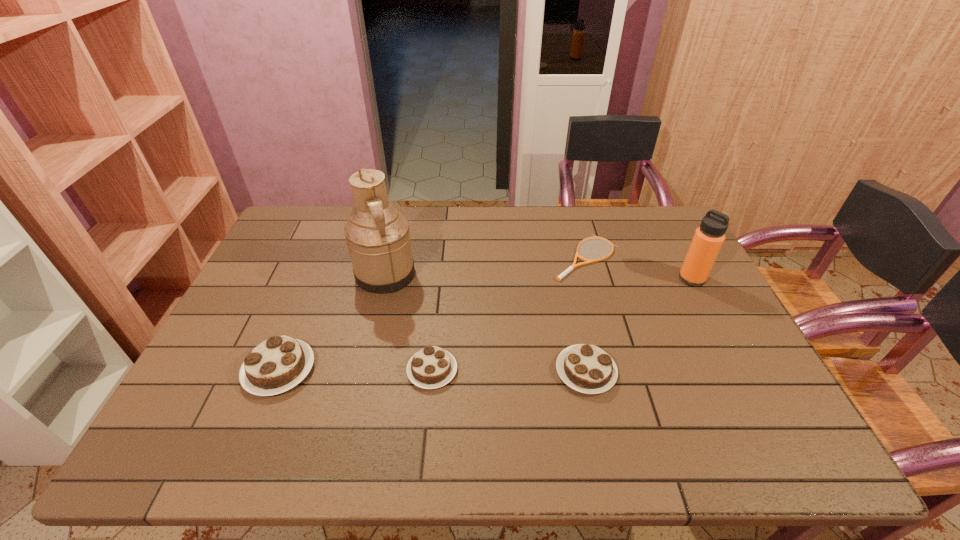
You are a GUI agent. You are given a task and a screenshot of the screen. Output one action in this format:
    pyautogui.click(x=<x>, y=<y>)
    Task: Click on the vacant region at the far edge
    The width and height of the screenshot is (960, 540).
    Given the screenshot: What is the action you would take?
    pyautogui.click(x=550, y=231)

What are the coordinates of `vacant space at the near edge of the desktop` in the screenshot? It's located at (421, 407).

The height and width of the screenshot is (540, 960). What are the coordinates of `vacant area at the left edge of the desktop` in the screenshot? It's located at (263, 323).

You are a GUI agent. You are given a task and a screenshot of the screen. Output one action in this format:
    pyautogui.click(x=<x>, y=<y>)
    Task: Click on the vacant space at the right edge of the desktop
    
    Given the screenshot: What is the action you would take?
    pyautogui.click(x=747, y=353)

Find the location of `blank space at the near left corner`. blank space at the near left corner is located at coordinates (185, 400).

This screenshot has height=540, width=960. Identify the location of vacant space in between the second tallest chocolate cake and the pitcher. (486, 323).

Image resolution: width=960 pixels, height=540 pixels. In order to click on free spot between the pitcher and the shortest object in this screenshot , I will do `click(486, 266)`.

Locate an element on the screen. Image resolution: width=960 pixels, height=540 pixels. empty space between the rightmost object and the tallest object is located at coordinates (539, 276).

Identify the location of vacant area between the rightmost chocolate cake and the tallest object. The height and width of the screenshot is (540, 960). (486, 323).

At what (x,y) coordinates should I click in order to perform the action: click on unoccupied area between the fifth shortest object and the tennis racket. Please return your answer as a coordinate pair (x, y). This screenshot has width=960, height=540. Looking at the image, I should click on (639, 268).